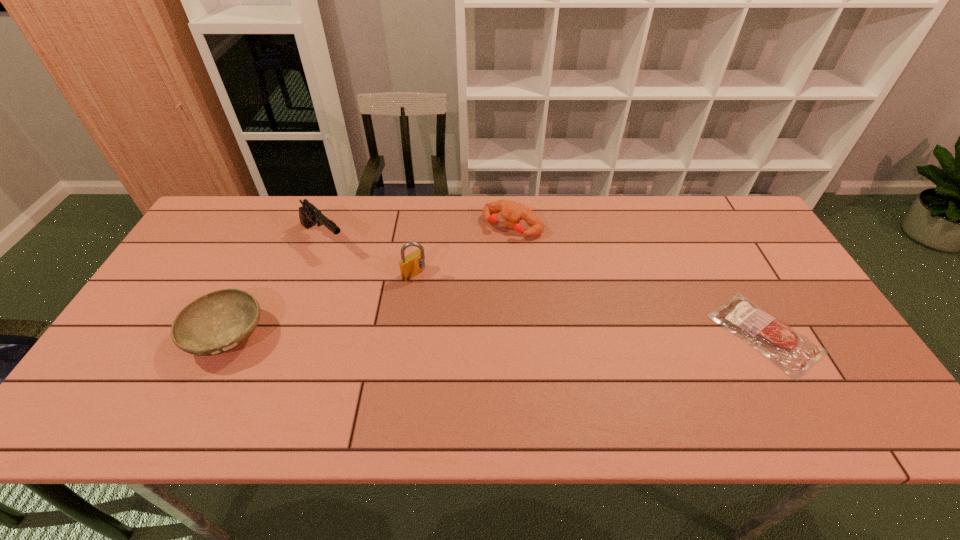
In the image, there is a desktop. Where is `vacant region at the far left corner`? The width and height of the screenshot is (960, 540). vacant region at the far left corner is located at coordinates (259, 210).

You are a GUI agent. You are given a task and a screenshot of the screen. Output one action in this format:
    pyautogui.click(x=<x>, y=<y>)
    Task: Click on the vacant point at the far right corner
    This screenshot has height=540, width=960.
    Given the screenshot: What is the action you would take?
    pyautogui.click(x=726, y=224)

In order to click on free space at the near right corner of the desktop in this screenshot , I will do `click(830, 380)`.

Where is `empty space between the shortest object and the bowl`? empty space between the shortest object and the bowl is located at coordinates (496, 335).

Locate an element on the screen. The image size is (960, 540). unoccupied area between the padlock and the steak is located at coordinates (590, 304).

This screenshot has width=960, height=540. In order to click on free point between the third nearest object and the bowl in this screenshot , I will do `click(322, 305)`.

Find the location of a particular element. The width and height of the screenshot is (960, 540). unoccupied area between the gun and the rightmost object is located at coordinates (544, 287).

Image resolution: width=960 pixels, height=540 pixels. Identify the location of blank region between the shortest object and the second object from right to left. (638, 280).

Where is `unoccupied position between the bowl and the puncher`? This screenshot has width=960, height=540. unoccupied position between the bowl and the puncher is located at coordinates (371, 281).

This screenshot has width=960, height=540. In order to click on empty location between the bowl and the gun in this screenshot , I will do `click(276, 288)`.